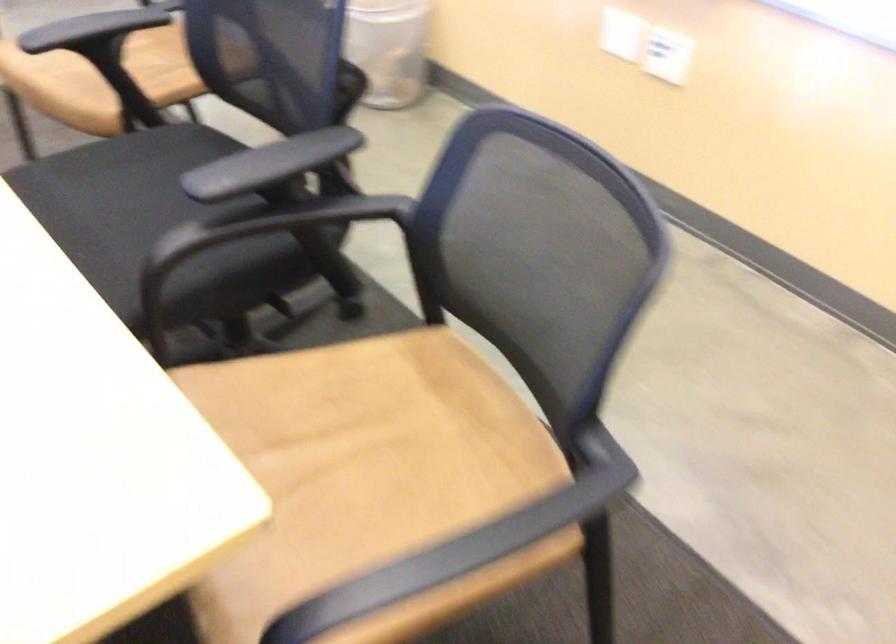
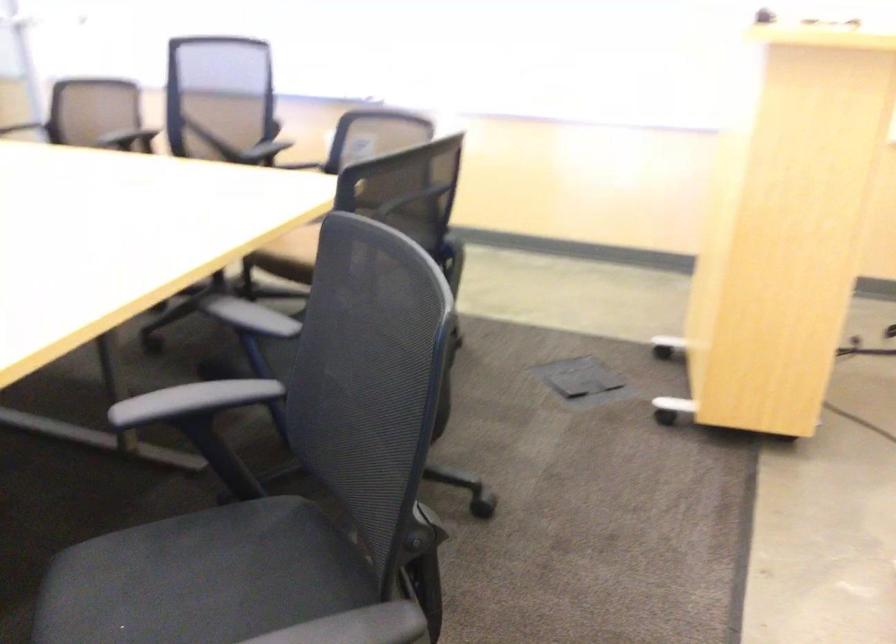
Question: I am providing you with two images of the same scene from different viewpoints. Please identify which objects are invisible in image2.

Choices:
 (A) black chair sitting surface
 (B) white Synology box
 (C) black chair armrest
 (D) tan chair sitting surface

Answer: (D)